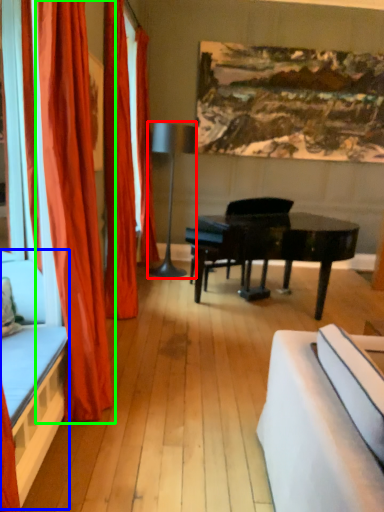
Question: Estimate the real-world distances between objects in this image. Which object is closer to lamp (highlighted by a red box), bed frame (highlighted by a blue box) or curtain (highlighted by a green box)?

Choices:
 (A) bed frame
 (B) curtain

Answer: (B)